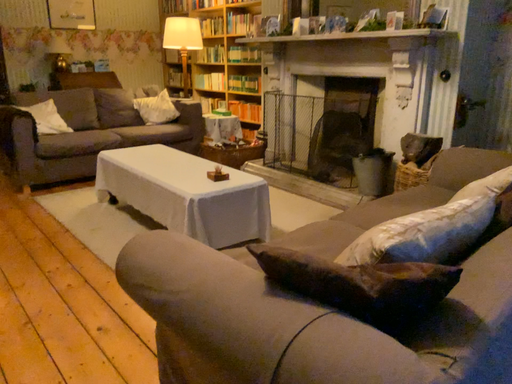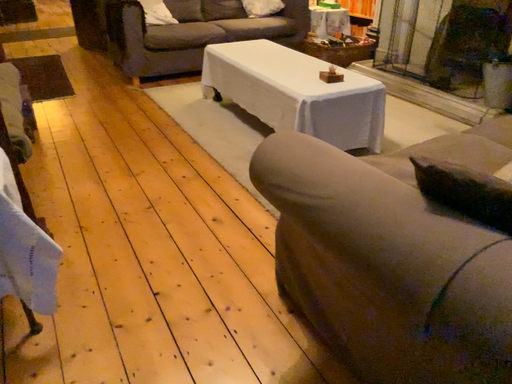
Question: Which way did the camera rotate in the video?

Choices:
 (A) rotated left
 (B) rotated right

Answer: (A)